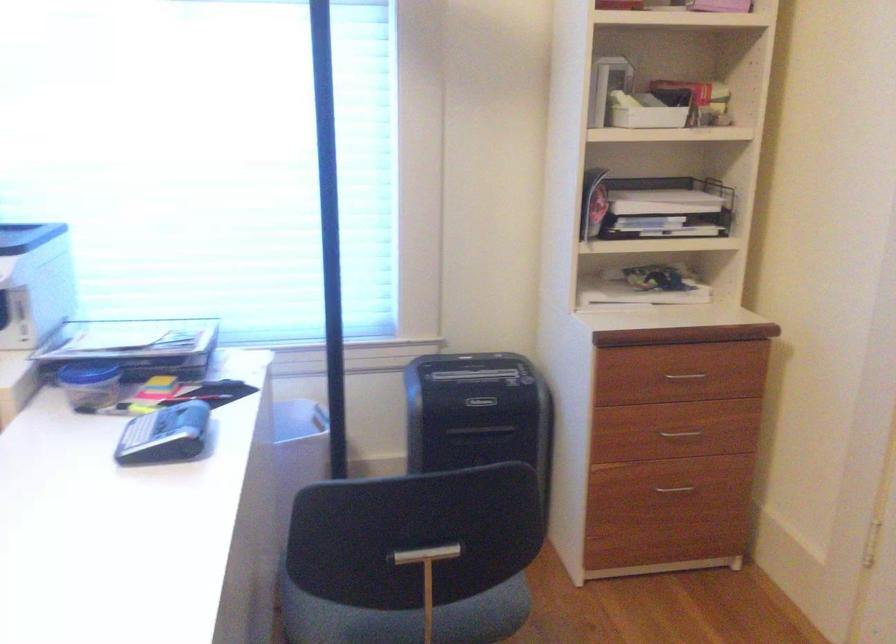
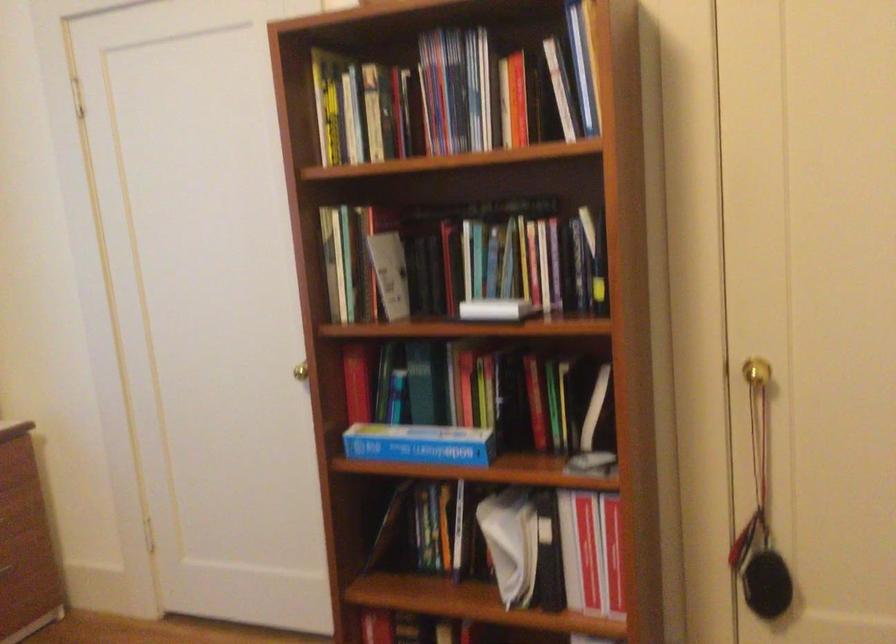
Question: The first image is from the beginning of the video and the second image is from the end. How did the camera likely rotate when shooting the video?

Choices:
 (A) Left
 (B) Right
 (C) Up
 (D) Down

Answer: (B)